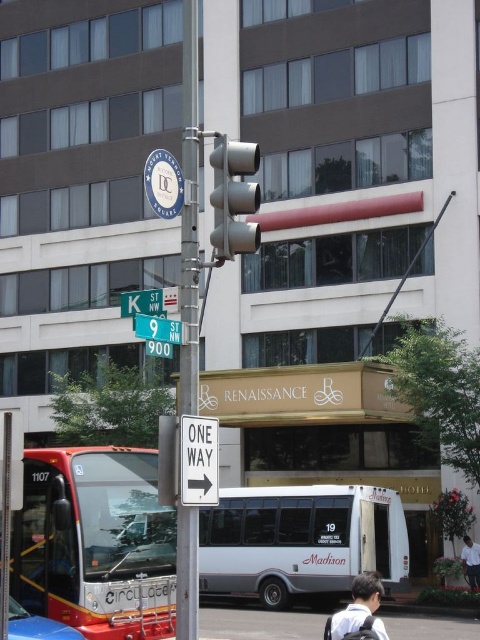
Does red metallic bus at lower left appear over light blue shirt at lower right?

Indeed, red metallic bus at lower left is positioned over light blue shirt at lower right.

Which is more to the left, red metallic bus at lower left or light blue shirt at lower right?

From the viewer's perspective, red metallic bus at lower left appears more on the left side.

Find the location of a particular element. red metallic bus at lower left is located at coordinates pos(96,541).

At what (x,y) coordinates should I click in order to perform the action: click on red metallic bus at lower left. Please return your answer as a coordinate pair (x, y). Looking at the image, I should click on (96, 541).

Between red metallic bus at lower left and green matte street sign at center, which one has more height?

red metallic bus at lower left is taller.

Who is more forward, (93, 586) or (165, 332)?

Point (165, 332)

Where is `red metallic bus at lower left`? Image resolution: width=480 pixels, height=640 pixels. red metallic bus at lower left is located at coordinates coord(96,541).

Is white metallic bus at center to the right of green matte street sign at center from the viewer's perspective?

Indeed, white metallic bus at center is positioned on the right side of green matte street sign at center.

Is white metallic bus at center wider than green matte street sign at center?

Indeed, white metallic bus at center has a greater width compared to green matte street sign at center.

The height and width of the screenshot is (640, 480). What do you see at coordinates (312, 483) in the screenshot? I see `white metallic bus at center` at bounding box center [312, 483].

This screenshot has width=480, height=640. Find the location of `white metallic bus at center`. white metallic bus at center is located at coordinates (312, 483).